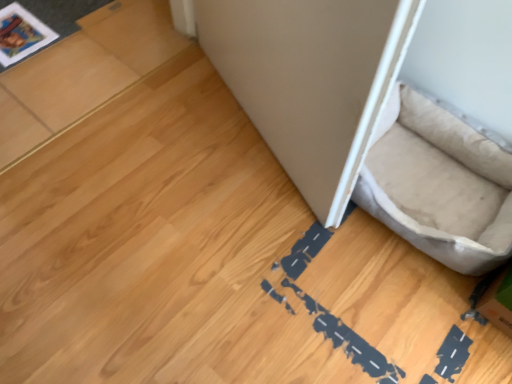
The image size is (512, 384). I want to click on vacant area that is in front of beige fabric dog bed at lower right, so click(389, 315).